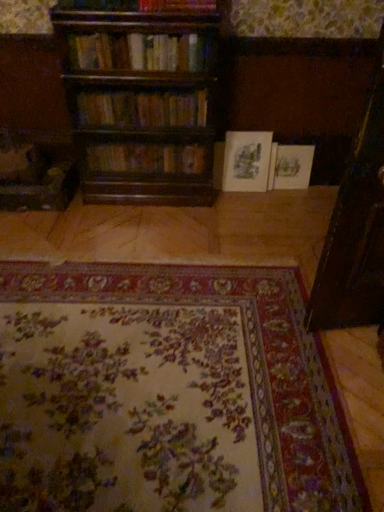
Question: Does floral carpet at center lie in front of wooden bookshelf at center, placed as the 4th book when sorted from back to front?

Choices:
 (A) yes
 (B) no

Answer: (A)

Question: Can you confirm if floral carpet at center is thinner than wooden bookshelf at center, marked as the second book in a front-to-back arrangement?

Choices:
 (A) yes
 (B) no

Answer: (B)

Question: Does floral carpet at center have a greater width compared to wooden bookshelf at center, marked as the second book in a front-to-back arrangement?

Choices:
 (A) yes
 (B) no

Answer: (A)

Question: Is floral carpet at center not within wooden bookshelf at center, placed as the 4th book when sorted from back to front?

Choices:
 (A) yes
 (B) no

Answer: (A)

Question: Can you confirm if floral carpet at center is taller than wooden bookshelf at center, marked as the second book in a front-to-back arrangement?

Choices:
 (A) no
 (B) yes

Answer: (A)

Question: Is floral carpet at center smaller than wooden bookshelf at center, placed as the 4th book when sorted from back to front?

Choices:
 (A) no
 (B) yes

Answer: (A)

Question: Can you confirm if white paper book at center, the 5th book in the front-to-back sequence, is wider than wooden bookshelf at center, which appears as the third book when viewed from the front?

Choices:
 (A) yes
 (B) no

Answer: (B)

Question: Does white paper book at center, the 5th book in the front-to-back sequence, appear on the right side of wooden bookshelf at center, which appears as the third book when viewed from the front?

Choices:
 (A) yes
 (B) no

Answer: (A)

Question: Can you confirm if white paper book at center, the 5th book in the front-to-back sequence, is positioned to the left of wooden bookshelf at center, which appears as the third book when viewed from the front?

Choices:
 (A) yes
 (B) no

Answer: (B)

Question: Is white paper book at center, the 5th book in the front-to-back sequence, positioned with its back to wooden bookshelf at center, the 3th book in the back-to-front sequence?

Choices:
 (A) yes
 (B) no

Answer: (B)

Question: Is white paper book at center, the 1th book positioned from the back, touching wooden bookshelf at center, the 3th book in the back-to-front sequence?

Choices:
 (A) yes
 (B) no

Answer: (B)

Question: Is white paper book at center, the 1th book positioned from the back, facing towards wooden bookshelf at center, the 3th book in the back-to-front sequence?

Choices:
 (A) no
 (B) yes

Answer: (A)

Question: Considering the relative sizes of wooden bookshelf at upper center, the fifth book viewed from the back, and wooden bookshelf at center, which appears as the third book when viewed from the front, in the image provided, is wooden bookshelf at upper center, the fifth book viewed from the back, smaller than wooden bookshelf at center, which appears as the third book when viewed from the front,?

Choices:
 (A) yes
 (B) no

Answer: (B)